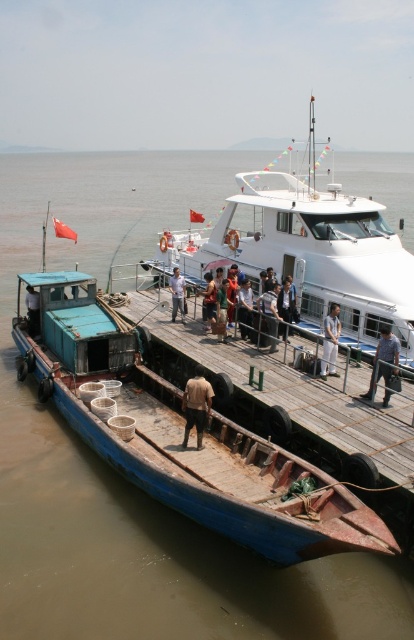
Which of these two, white glossy boat at center or brown fabric shirt at center, stands taller?

Standing taller between the two is white glossy boat at center.

Who is lower down, white glossy boat at center or brown fabric shirt at center?

brown fabric shirt at center is below.

Who is more forward, (x=373, y=310) or (x=185, y=435)?

Point (x=185, y=435)

The width and height of the screenshot is (414, 640). Identify the location of white glossy boat at center. (308, 252).

How distant is wooden dock at center from light brown leather jacket at center?

A distance of 13.69 feet exists between wooden dock at center and light brown leather jacket at center.

Between wooden dock at center and light brown leather jacket at center, which one appears on the right side from the viewer's perspective?

wooden dock at center is more to the right.

Identify the location of wooden dock at center. This screenshot has width=414, height=640. (300, 403).

Which is above, light brown leather jacket at center or light brown wooden pole at center?

Positioned higher is light brown wooden pole at center.

Can you confirm if light brown leather jacket at center is smaller than light brown wooden pole at center?

Correct, light brown leather jacket at center occupies less space than light brown wooden pole at center.

This screenshot has height=640, width=414. What are the coordinates of `light brown leather jacket at center` in the screenshot? It's located at (209, 300).